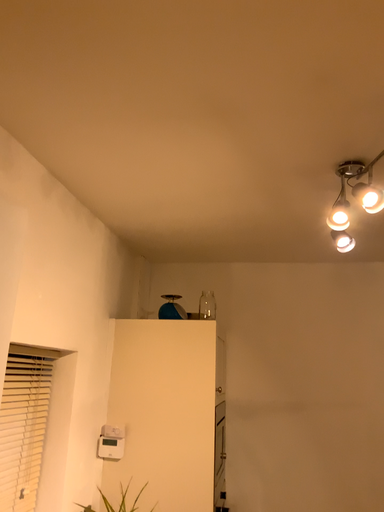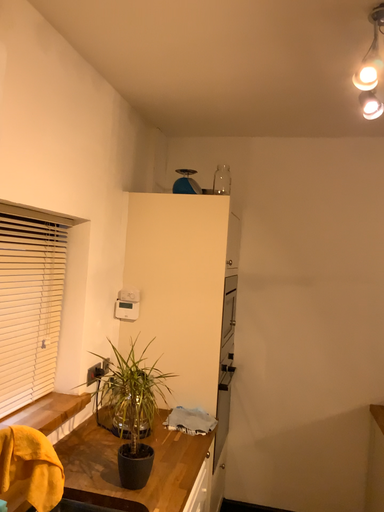
Question: How did the camera likely rotate when shooting the video?

Choices:
 (A) rotated upward
 (B) rotated downward

Answer: (B)